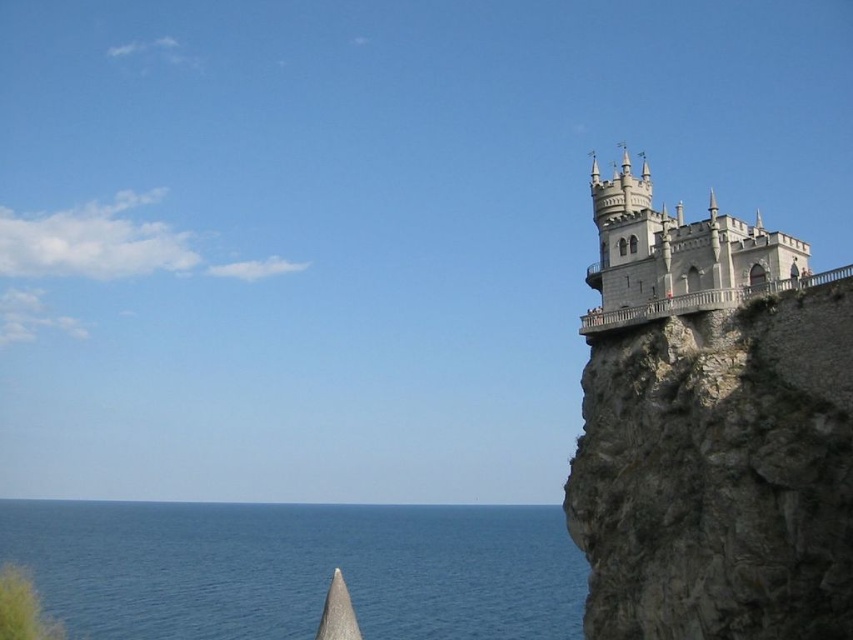
Does blue water at lower left have a smaller size compared to white stone castle at upper right?

Actually, blue water at lower left might be larger than white stone castle at upper right.

Which is more to the left, blue water at lower left or white stone castle at upper right?

blue water at lower left is more to the left.

Locate an element on the screen. This screenshot has width=853, height=640. blue water at lower left is located at coordinates (297, 568).

Is point (741, 496) positioned in front of point (706, 285)?

Yes, point (741, 496) is closer to viewer.

Can you confirm if gray rocky cliff at right is positioned to the left of white stone castle at upper right?

Indeed, gray rocky cliff at right is positioned on the left side of white stone castle at upper right.

What do you see at coordinates (718, 474) in the screenshot? I see `gray rocky cliff at right` at bounding box center [718, 474].

The height and width of the screenshot is (640, 853). I want to click on gray rocky cliff at right, so click(718, 474).

Is the position of gray rocky cliff at right less distant than that of blue water at lower left?

Yes.

Does gray rocky cliff at right have a smaller size compared to blue water at lower left?

Yes, gray rocky cliff at right is smaller than blue water at lower left.

What do you see at coordinates (718, 474) in the screenshot? This screenshot has width=853, height=640. I see `gray rocky cliff at right` at bounding box center [718, 474].

Where is `gray rocky cliff at right`? The width and height of the screenshot is (853, 640). gray rocky cliff at right is located at coordinates (718, 474).